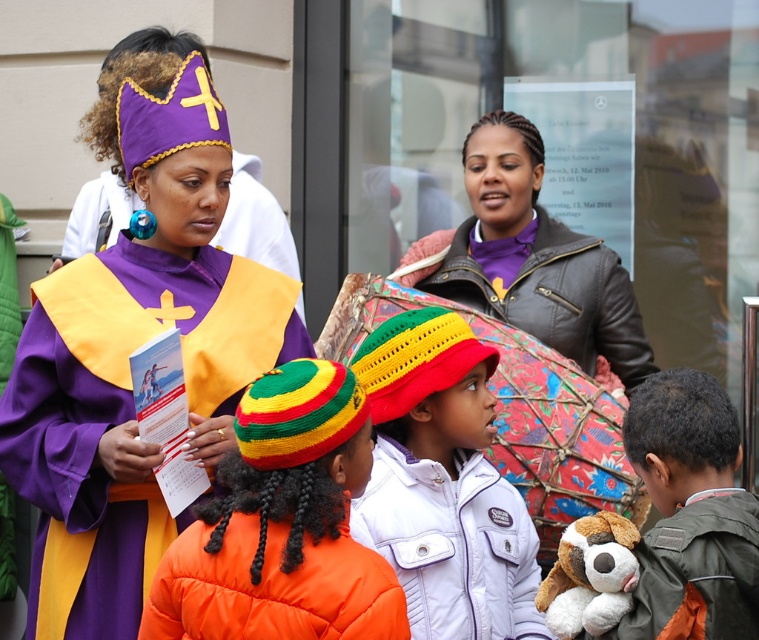
Does point (682, 637) lie behind point (257, 252)?

No, it is not.

This screenshot has width=759, height=640. What do you see at coordinates (690, 513) in the screenshot? I see `green textured jacket at lower right` at bounding box center [690, 513].

Who is more forward, [713,518] or [282,214]?

Point [713,518] is more forward.

In order to click on green textured jacket at lower right in this screenshot , I will do `click(690, 513)`.

Who is higher up, purple leather jacket at upper center or purple velvet crown at upper left?

Positioned higher is purple velvet crown at upper left.

Who is positioned more to the left, purple leather jacket at upper center or purple velvet crown at upper left?

purple velvet crown at upper left is more to the left.

Is point (493, 234) behind point (257, 241)?

That is False.

Find the location of a particular element. The width and height of the screenshot is (759, 640). purple leather jacket at upper center is located at coordinates (537, 257).

Is purple leather jacket at upper center wider than green textured jacket at lower right?

Yes, purple leather jacket at upper center is wider than green textured jacket at lower right.

Between purple leather jacket at upper center and green textured jacket at lower right, which one has more height?

With more height is purple leather jacket at upper center.

Is point (515, 289) closer to camera compared to point (756, 522)?

No, it is behind (756, 522).

Image resolution: width=759 pixels, height=640 pixels. In order to click on purple leather jacket at upper center in this screenshot , I will do `click(537, 257)`.